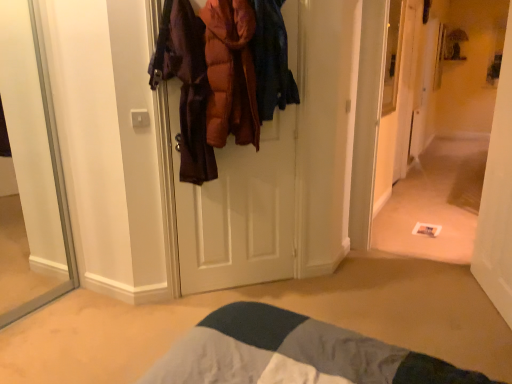
Question: Considering the positions of orange puffy jacket at center and white glossy door at center in the image, is orange puffy jacket at center taller or shorter than white glossy door at center?

Choices:
 (A) tall
 (B) short

Answer: (B)

Question: From the image's perspective, is orange puffy jacket at center located above or below white glossy door at center?

Choices:
 (A) below
 (B) above

Answer: (B)

Question: Estimate the real-world distances between objects in this image. Which object is closer to the orange puffy jacket at center?

Choices:
 (A) white glossy door at center
 (B) white carpet at center

Answer: (A)

Question: Estimate the real-world distances between objects in this image. Which object is closer to the white glossy door at center?

Choices:
 (A) orange puffy jacket at center
 (B) white carpet at center

Answer: (A)